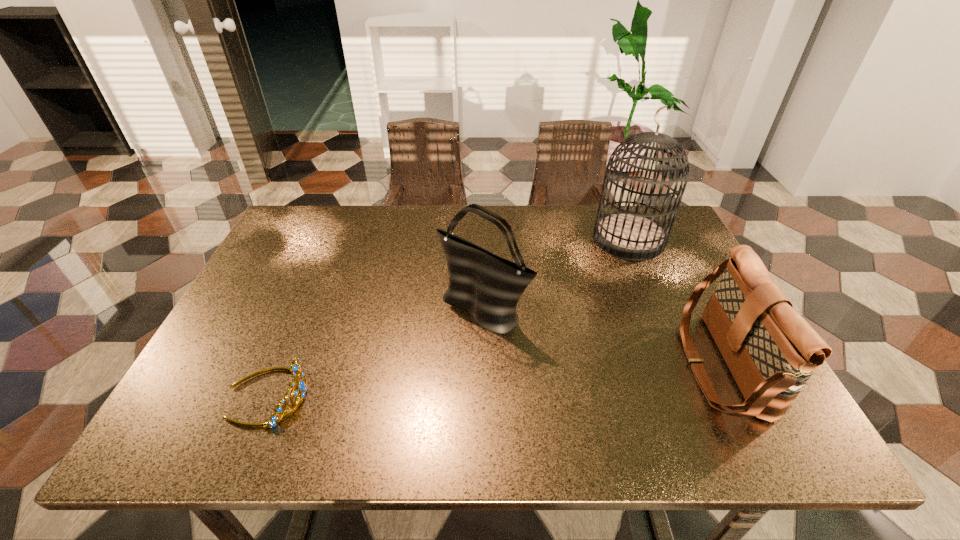
The width and height of the screenshot is (960, 540). Find the location of `free space between the leftmost object and the farthest object`. free space between the leftmost object and the farthest object is located at coordinates (448, 317).

Where is `empty location between the third shortest object and the birdcage`? empty location between the third shortest object and the birdcage is located at coordinates (556, 274).

Identify the location of blank region between the shortest object and the tallest object. The image size is (960, 540). (448, 317).

Find the location of a particular element. This screenshot has width=960, height=540. free spot between the leftmost object and the birdcage is located at coordinates (448, 317).

You are a GUI agent. You are given a task and a screenshot of the screen. Output one action in this format:
    pyautogui.click(x=<x>, y=<y>)
    Task: Click on the vacant area that lies between the farthest object and the third shortest object
    The height and width of the screenshot is (540, 960).
    Given the screenshot: What is the action you would take?
    pyautogui.click(x=556, y=274)

Where is `unoccupied area between the birdcage and the leftmost object`? unoccupied area between the birdcage and the leftmost object is located at coordinates (448, 317).

At what (x,y) coordinates should I click in order to perform the action: click on free space between the right shoulder bag and the third object from right to left. Please return your answer as a coordinate pair (x, y). This screenshot has width=960, height=540. Looking at the image, I should click on (601, 337).

I want to click on unoccupied position between the farthest object and the third tallest object, so tap(674, 302).

Locate which object is the third closest to the shortest object. Please provide its 2D coordinates. Your answer should be formatted as a tuple, i.e. [(x, y)], where the tuple contains the x and y coordinates of a point satisfying the conditions above.

[(771, 351)]

Find the location of `object that is the closest to the second shortest object`. object that is the closest to the second shortest object is located at coordinates (628, 235).